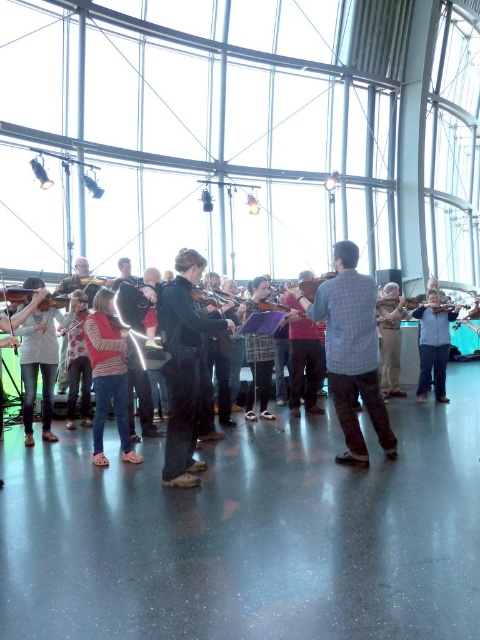
Question: Which object appears closest to the camera in this image?

Choices:
 (A) checkered fabric shirt at center
 (B) light blue denim jeans at center
 (C) black fabric violin at center

Answer: (C)

Question: Does light blue denim jeans at center appear on the left side of black fabric violin at center?

Choices:
 (A) yes
 (B) no

Answer: (B)

Question: Does checkered fabric shirt at center have a smaller size compared to black fabric violin at center?

Choices:
 (A) yes
 (B) no

Answer: (A)

Question: Which of these objects is positioned farthest from the light blue denim jeans at center?

Choices:
 (A) black fabric violin at center
 (B) checkered fabric shirt at center
 (C) black leather jacket at center

Answer: (C)

Question: Is checkered fabric shirt at center above light blue denim jeans at center?

Choices:
 (A) no
 (B) yes

Answer: (B)

Question: Among these points, which one is nearest to the camera?

Choices:
 (A) (204, 332)
 (B) (372, 422)
 (C) (425, 307)

Answer: (A)